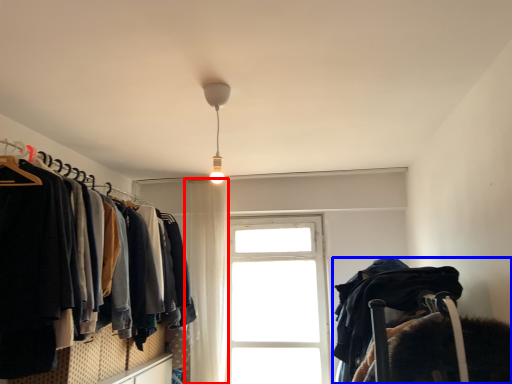
Question: Among these objects, which one is farthest to the camera, curtain (highlighted by a red box) or bunk bed (highlighted by a blue box)?

Choices:
 (A) curtain
 (B) bunk bed

Answer: (A)